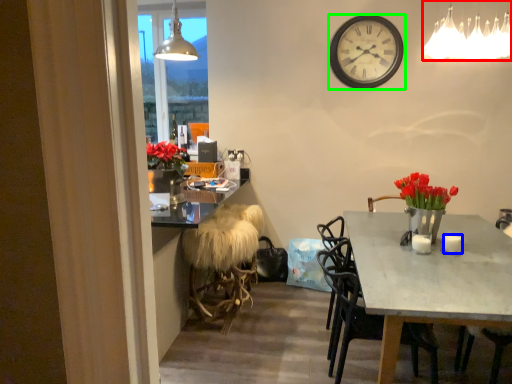
Question: Estimate the real-world distances between objects in this image. Which object is farther from lamp (highlighted by a red box), coffee cup (highlighted by a blue box) or wall clock (highlighted by a green box)?

Choices:
 (A) coffee cup
 (B) wall clock

Answer: (A)